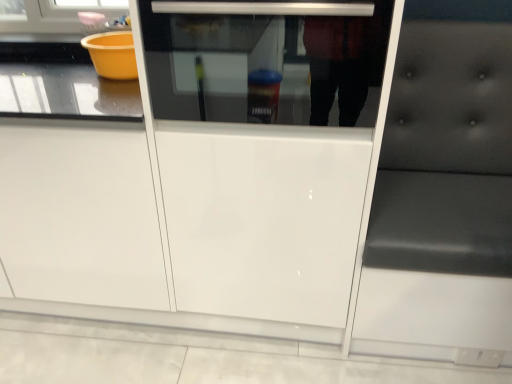
Question: Does black leather cushion at right have a smaller size compared to transparent glass oven at center?

Choices:
 (A) yes
 (B) no

Answer: (B)

Question: Considering the relative sizes of black leather cushion at right and transparent glass oven at center in the image provided, is black leather cushion at right shorter than transparent glass oven at center?

Choices:
 (A) no
 (B) yes

Answer: (A)

Question: Does black leather cushion at right have a greater height compared to transparent glass oven at center?

Choices:
 (A) yes
 (B) no

Answer: (A)

Question: Considering the relative positions of black leather cushion at right and transparent glass oven at center in the image provided, is black leather cushion at right in front of transparent glass oven at center?

Choices:
 (A) no
 (B) yes

Answer: (B)

Question: From a real-world perspective, is black leather cushion at right positioned under transparent glass oven at center based on gravity?

Choices:
 (A) no
 (B) yes

Answer: (B)

Question: Can we say black leather cushion at right lies outside transparent glass oven at center?

Choices:
 (A) yes
 (B) no

Answer: (A)

Question: Is transparent glass oven at center not inside black leather cushion at right?

Choices:
 (A) no
 (B) yes

Answer: (B)

Question: Is transparent glass oven at center shorter than black leather cushion at right?

Choices:
 (A) yes
 (B) no

Answer: (A)

Question: Does transparent glass oven at center appear on the right side of black leather cushion at right?

Choices:
 (A) yes
 (B) no

Answer: (B)

Question: Can you confirm if transparent glass oven at center is smaller than black leather cushion at right?

Choices:
 (A) no
 (B) yes

Answer: (B)

Question: Is transparent glass oven at center positioned far away from black leather cushion at right?

Choices:
 (A) no
 (B) yes

Answer: (A)

Question: Could black leather cushion at right be considered to be inside transparent glass oven at center?

Choices:
 (A) no
 (B) yes

Answer: (A)

Question: Is black leather cushion at right taller or shorter than transparent glass oven at center?

Choices:
 (A) short
 (B) tall

Answer: (B)